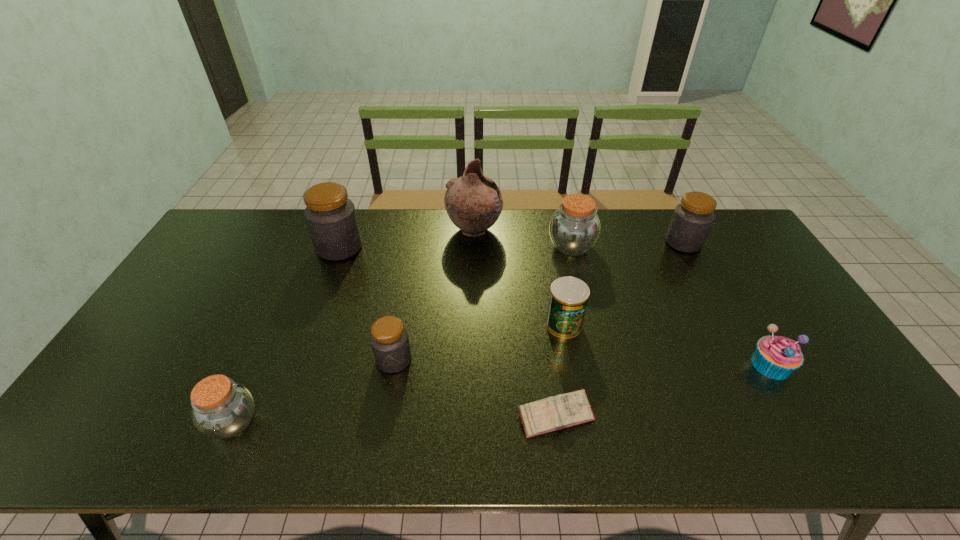
Identify the location of the tallest object. This screenshot has height=540, width=960. (473, 202).

At what (x,y) coordinates should I click in order to perform the action: click on the fourth object from left to right. Please return your answer as a coordinate pair (x, y). The image size is (960, 540). Looking at the image, I should click on (473, 202).

You are a GUI agent. You are given a task and a screenshot of the screen. Output one action in this format:
    pyautogui.click(x=<x>, y=<y>)
    Task: Click on the leftmost gray jar
    The height and width of the screenshot is (540, 960).
    Given the screenshot: What is the action you would take?
    pyautogui.click(x=331, y=218)

Locate an element on the screen. the biggest gray jar is located at coordinates (331, 218).

Find the location of a particular element. The image size is (960, 540). the second biggest gray jar is located at coordinates (692, 219).

Locate an element on the screen. The width and height of the screenshot is (960, 540). the rightmost jar is located at coordinates (692, 219).

This screenshot has height=540, width=960. I want to click on the right brown jar, so click(574, 228).

I want to click on the fourth jar from left to right, so click(x=574, y=228).

Locate an element on the screen. can is located at coordinates (568, 299).

Find the location of a particular element. This screenshot has height=540, width=960. the fourth farthest jar is located at coordinates (389, 339).